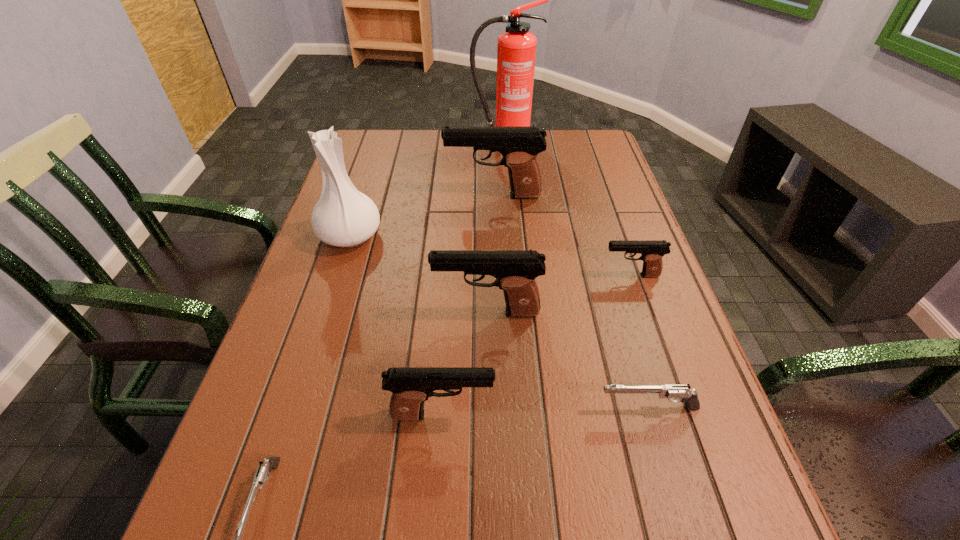
I want to click on object that is at the left edge, so click(344, 217).

Where is `free region at the far edge of the desktop`? This screenshot has height=540, width=960. free region at the far edge of the desktop is located at coordinates (429, 132).

The width and height of the screenshot is (960, 540). Identify the location of free region at the left edge of the desktop. (387, 180).

In the image, there is a desktop. In order to click on free space at the right edge in this screenshot , I will do `click(644, 323)`.

Identify the location of free space at the near right corner. Image resolution: width=960 pixels, height=540 pixels. (728, 537).

Where is `free space between the fifth tallest object and the fire extinguisher`? free space between the fifth tallest object and the fire extinguisher is located at coordinates (473, 277).

You are a GUI agent. You are given a task and a screenshot of the screen. Output one action in this format:
    pyautogui.click(x=<x>, y=<y>)
    Task: Click on the free space that is in between the third tallest pistol and the tallest object
    This screenshot has height=540, width=960.
    Given the screenshot: What is the action you would take?
    pyautogui.click(x=473, y=277)

Identify the location of free space that is in between the fifth shortest object and the fire extinguisher. (495, 226).

This screenshot has width=960, height=540. Identify the location of blank region between the third tallest object and the rightmost black pistol. (562, 235).

Locate an element on the screen. This screenshot has width=960, height=540. vacant point located between the third farthest pistol and the second shortest object is located at coordinates (567, 360).